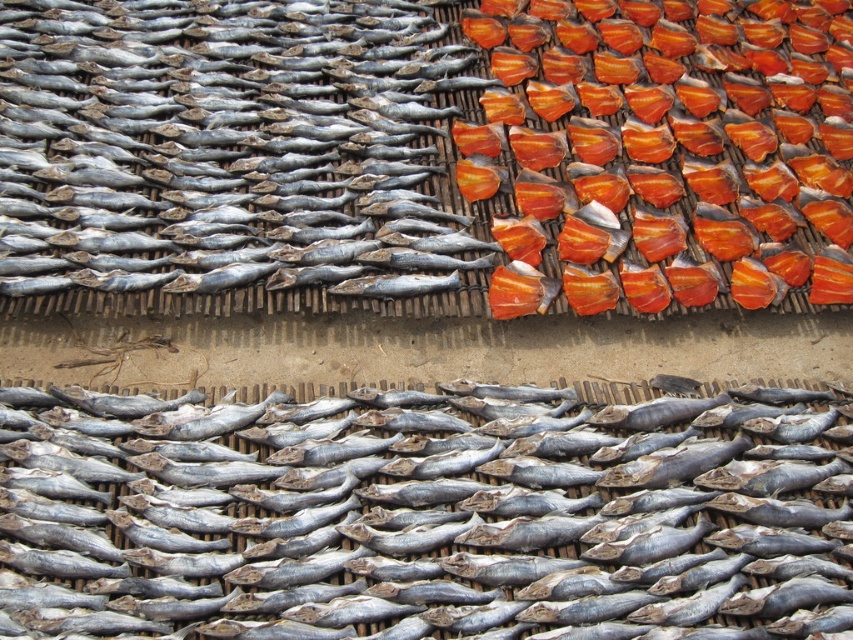
What are the coordinates of the silvery matte fish at upper left?

The silvery matte fish at upper left is located at coordinates point (210,140).

You are a fishmonger preparing to pack the grayish matte fish at center and the silvery matte fish at upper left into boxes. The boxes can only hold fish that are larger than 15 cm in length. Based on the scene, which fish will you select for packing?

The silvery matte fish at upper left is larger in size compared to the grayish matte fish at center, so you should select the silvery matte fish at upper left for packing into the boxes since they meet the size requirement.